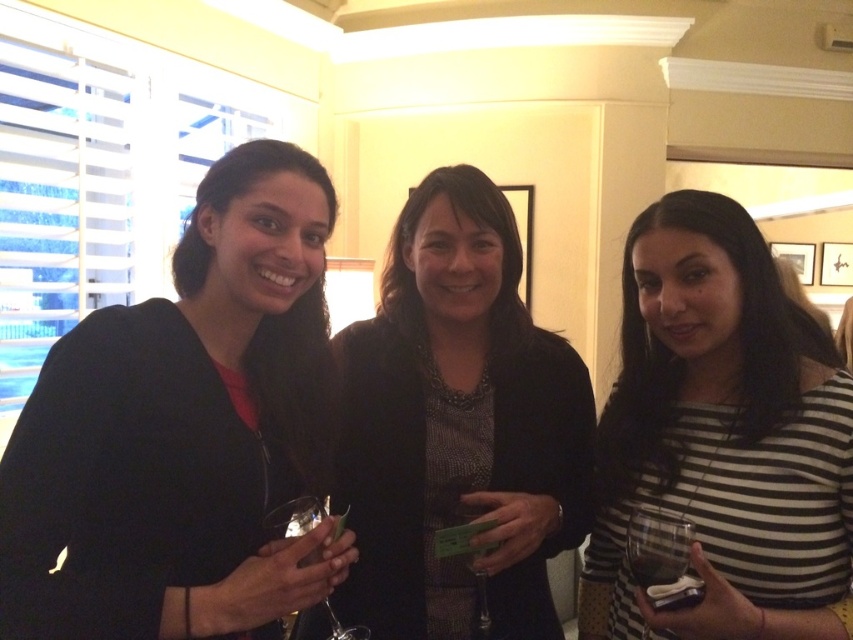
You are at a social event and want to grab the clear glass wine glass at lower right without touching the matte black blazer at center. Is this possible given their positions?

The matte black blazer at center is above the clear glass wine glass at lower right, so you can reach the glass without touching the blazer as it is positioned below.

You are at a party and want to pass a napkin to the person wearing the black matte sweater at left without touching the clear glass wine glass at center. How much space do you need to leave between the napkin and the glass?

The black matte sweater at left is 20.47 centimeters from the clear glass wine glass at center, so you should leave at least 20.47 centimeters of space between the napkin and the glass to avoid touching it.